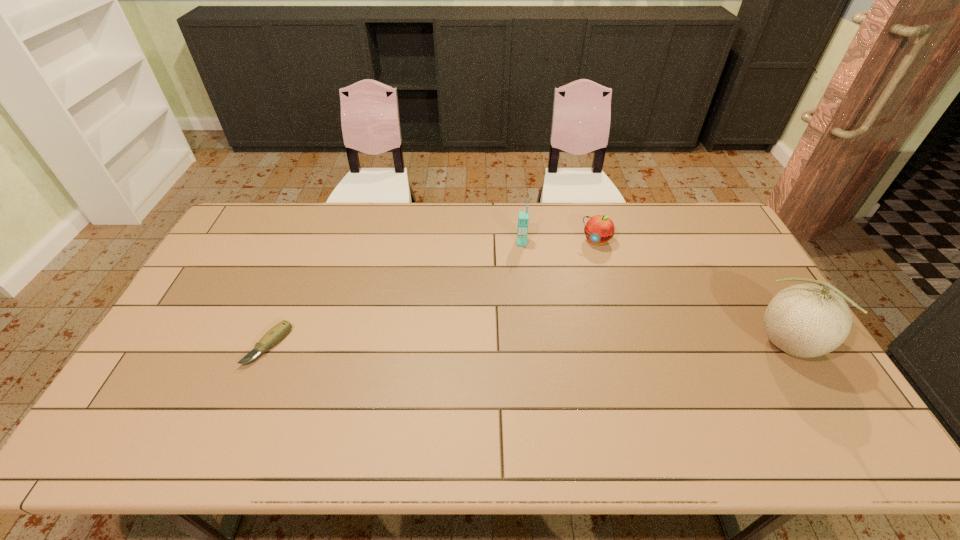
At what (x,y) coordinates should I click in order to perform the action: click on free space at the left edge. Please return your answer as a coordinate pair (x, y). The width and height of the screenshot is (960, 540). Looking at the image, I should click on (238, 275).

In the image, there is a desktop. At what (x,y) coordinates should I click in order to perform the action: click on blank space at the right edge. Please return your answer as a coordinate pair (x, y). Looking at the image, I should click on (788, 373).

The width and height of the screenshot is (960, 540). I want to click on free space at the near right corner of the desktop, so click(789, 382).

The height and width of the screenshot is (540, 960). Find the location of `vacant point located between the third shortest object and the third tallest object`. vacant point located between the third shortest object and the third tallest object is located at coordinates (559, 241).

The image size is (960, 540). I want to click on free spot between the tallest object and the pocketknife, so 529,346.

Identify the location of free space between the rightmost object and the apple. (692, 293).

The image size is (960, 540). I want to click on vacant space that is in between the leftmost object and the rightmost object, so click(x=529, y=346).

This screenshot has height=540, width=960. I want to click on free space that is in between the second shortest object and the leftmost object, so click(x=432, y=293).

This screenshot has height=540, width=960. What are the coordinates of `blank region between the shortest object and the third shortest object` in the screenshot? It's located at (395, 294).

Where is `vacant region between the shortest object and the second object from right to left`? The height and width of the screenshot is (540, 960). vacant region between the shortest object and the second object from right to left is located at coordinates (432, 293).